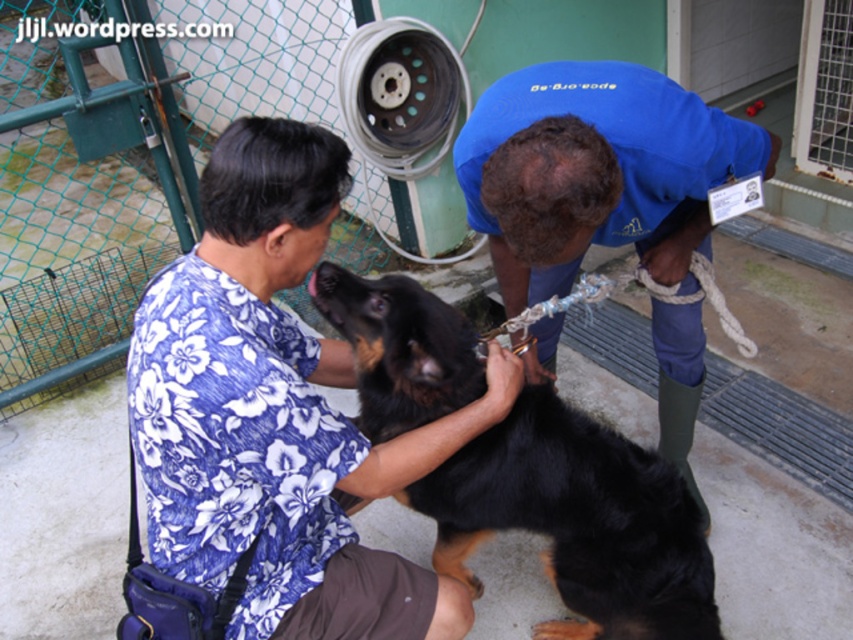
Between point (231, 544) and point (654, 244), which one is positioned behind?

The point (654, 244) is more distant.

Does floral fabric shirt at lower left have a greater height compared to blue fabric shirt at center?

No, floral fabric shirt at lower left is not taller than blue fabric shirt at center.

Identify the location of floral fabric shirt at lower left. (277, 412).

Between floral fabric shirt at lower left and black fur dog at center, which one has more height?

floral fabric shirt at lower left

Which is in front, point (309, 164) or point (485, 481)?

Positioned in front is point (309, 164).

Does point (310, 420) come farther from viewer compared to point (573, 504)?

No, (310, 420) is in front of (573, 504).

Where is `floral fabric shirt at lower left`? floral fabric shirt at lower left is located at coordinates (277, 412).

Is the position of black fur dog at center less distant than that of blue fabric shirt at center?

That is False.

Can you confirm if black fur dog at center is smaller than blue fabric shirt at center?

Yes.

What do you see at coordinates (578, 522) in the screenshot? I see `black fur dog at center` at bounding box center [578, 522].

Identify the location of black fur dog at center. This screenshot has width=853, height=640. (578, 522).